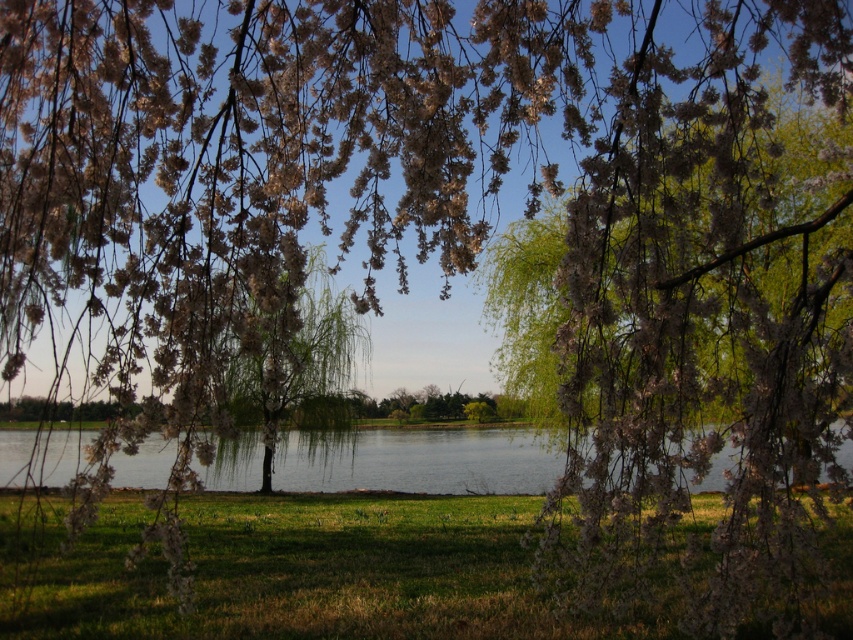
Where is `green grass at lower center`? The width and height of the screenshot is (853, 640). green grass at lower center is located at coordinates (306, 572).

Where is `green grass at lower center`? The height and width of the screenshot is (640, 853). green grass at lower center is located at coordinates (306, 572).

Is clear water at center smaller than green leafy willow at center?

Incorrect, clear water at center is not smaller in size than green leafy willow at center.

Does point (322, 468) lie behind point (233, 452)?

Yes, it is behind point (233, 452).

The image size is (853, 640). What are the coordinates of `clear water at center` in the screenshot? It's located at (421, 460).

Identify the location of green grass at lower center. The height and width of the screenshot is (640, 853). (306, 572).

Is green grass at lower center further to the viewer compared to clear water at center?

Answer: No, it is in front of clear water at center.

Who is more distant from viewer, (277, 502) or (149, 436)?

Positioned behind is point (277, 502).

Find the location of a particular element. The width and height of the screenshot is (853, 640). green grass at lower center is located at coordinates (306, 572).